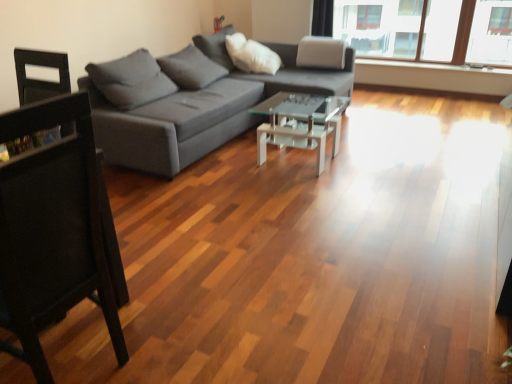
Question: Is black wood chair at left behind gray fabric couch at center?

Choices:
 (A) no
 (B) yes

Answer: (A)

Question: Is black wood chair at left at the right side of gray fabric couch at center?

Choices:
 (A) no
 (B) yes

Answer: (A)

Question: Is black wood chair at left far from gray fabric couch at center?

Choices:
 (A) no
 (B) yes

Answer: (B)

Question: From the image's perspective, does black wood chair at left appear lower than gray fabric couch at center?

Choices:
 (A) no
 (B) yes

Answer: (B)

Question: Does black wood chair at left lie in front of gray fabric couch at center?

Choices:
 (A) yes
 (B) no

Answer: (A)

Question: From a real-world perspective, is gray fabric couch at center physically located above or below transparent glass coffee table at center?

Choices:
 (A) above
 (B) below

Answer: (A)

Question: From their relative heights in the image, would you say gray fabric couch at center is taller or shorter than transparent glass coffee table at center?

Choices:
 (A) short
 (B) tall

Answer: (B)

Question: From the image's perspective, is gray fabric couch at center above or below transparent glass coffee table at center?

Choices:
 (A) above
 (B) below

Answer: (A)

Question: Is gray fabric couch at center bigger or smaller than transparent glass coffee table at center?

Choices:
 (A) small
 (B) big

Answer: (B)

Question: Looking at their shapes, would you say transparent glass coffee table at center is wider or thinner than black wood chair at left?

Choices:
 (A) thin
 (B) wide

Answer: (B)

Question: From a real-world perspective, is transparent glass coffee table at center positioned above or below black wood chair at left?

Choices:
 (A) below
 (B) above

Answer: (A)

Question: In terms of height, does transparent glass coffee table at center look taller or shorter compared to black wood chair at left?

Choices:
 (A) short
 (B) tall

Answer: (A)

Question: Is point (287, 140) positioned closer to the camera than point (39, 223)?

Choices:
 (A) closer
 (B) farther

Answer: (B)

Question: Is gray fabric couch at center situated inside black wood chair at left or outside?

Choices:
 (A) inside
 (B) outside

Answer: (B)

Question: From a real-world perspective, relative to black wood chair at left, is gray fabric couch at center vertically above or below?

Choices:
 (A) above
 (B) below

Answer: (B)